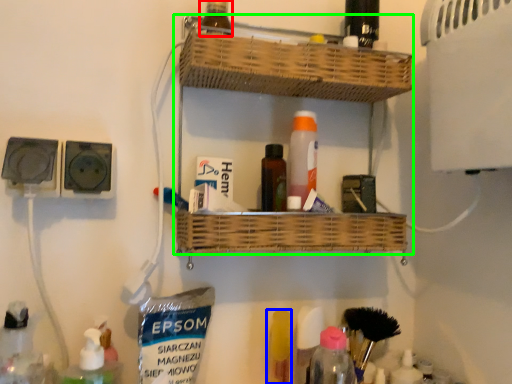
Question: Which object is the closest to the bottle (highlighted by a red box)? Choose among these: toiletry (highlighted by a blue box) or shelf (highlighted by a green box).

Choices:
 (A) toiletry
 (B) shelf

Answer: (B)